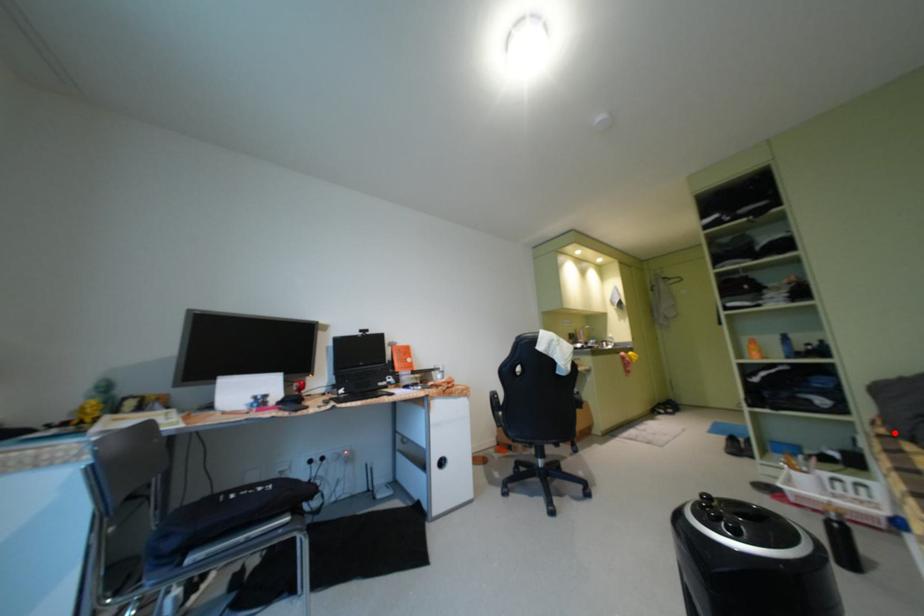
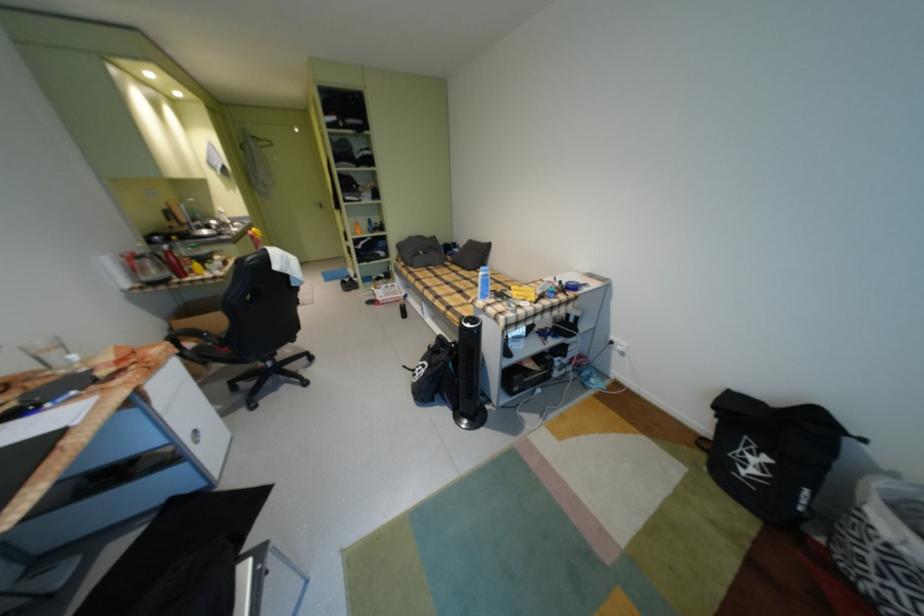
Locate, in the second image, the point that corresponds to the highlighted location in the first image.

(412, 265)